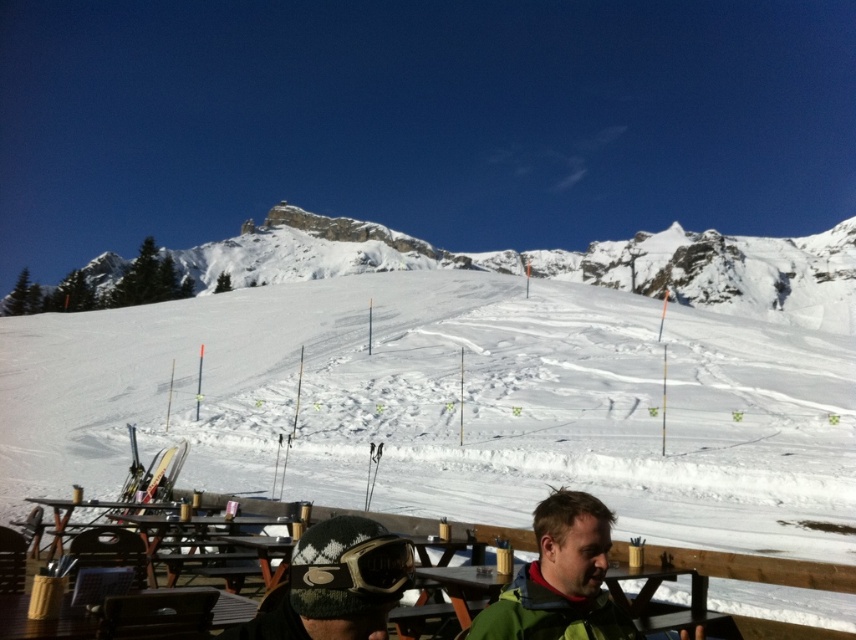
Which is above, white powdery snow at center or green woolen jacket at lower center?

Positioned higher is white powdery snow at center.

Looking at this image, can you confirm if white powdery snow at center is positioned to the left of green woolen jacket at lower center?

Correct, you'll find white powdery snow at center to the left of green woolen jacket at lower center.

Is point (88, 392) positioned before point (531, 604)?

No.

Find the location of `white powdery snow at center`. white powdery snow at center is located at coordinates (450, 404).

The image size is (856, 640). Describe the element at coordinates (562, 262) in the screenshot. I see `white snow-covered mountain at upper center` at that location.

Find the location of a particular element. white snow-covered mountain at upper center is located at coordinates (562, 262).

The width and height of the screenshot is (856, 640). In order to click on white snow-covered mountain at upper center in this screenshot , I will do `click(562, 262)`.

Between white powdery snow at center and green knitted hat at lower center, which one appears on the left side from the viewer's perspective?

Positioned to the left is white powdery snow at center.

Between white powdery snow at center and green knitted hat at lower center, which one is positioned lower?

green knitted hat at lower center

Which is behind, point (736, 358) or point (394, 552)?

The point (736, 358) is more distant.

Where is `white powdery snow at center`? white powdery snow at center is located at coordinates (450, 404).